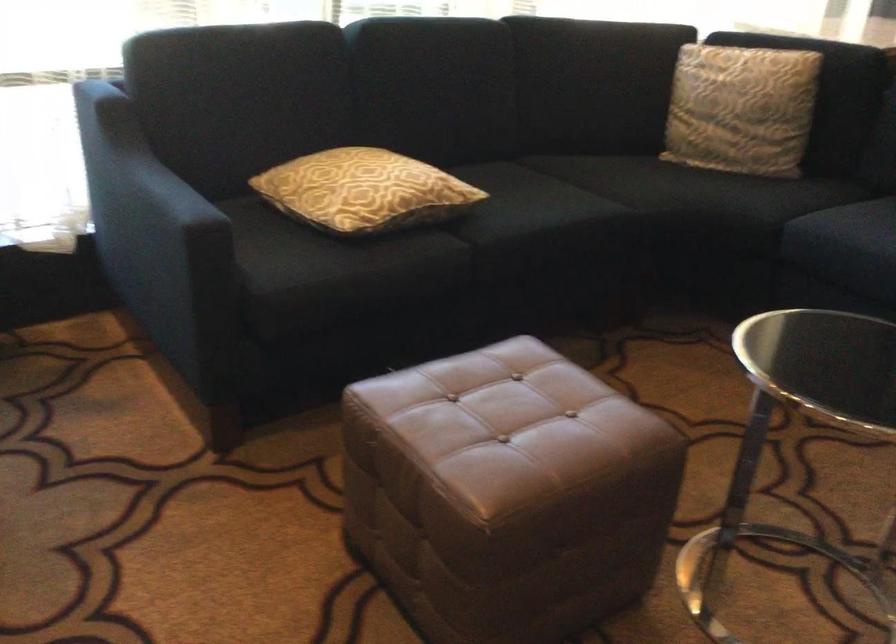
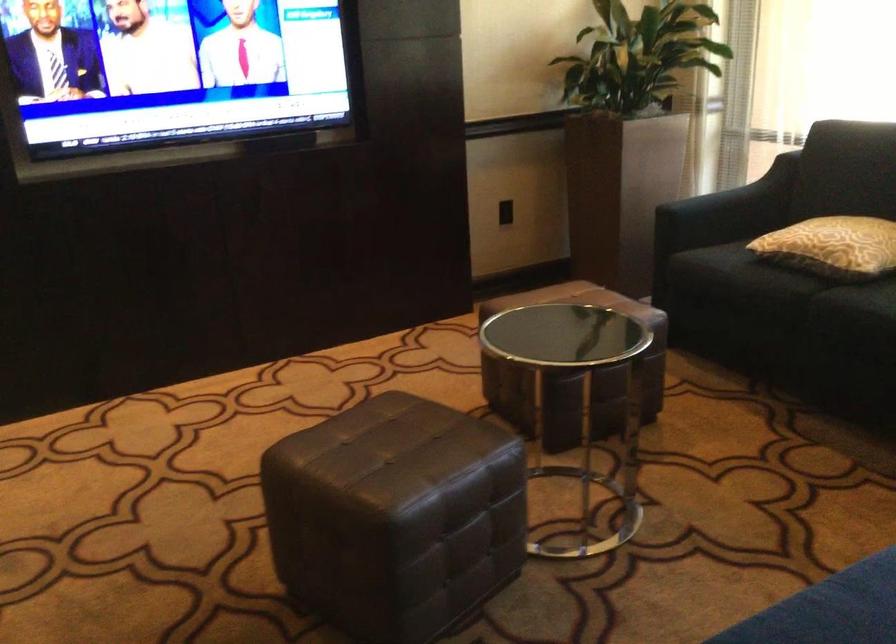
Where in the second image is the point corresponding to (x=444, y=192) from the first image?

(832, 245)